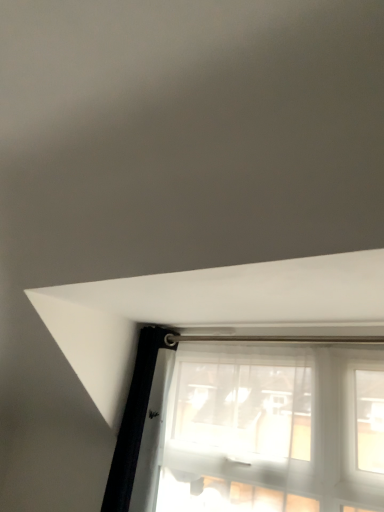
Question: Considering the relative sizes of metallic silver curtain rod at center and translucent fabric window at lower center in the image provided, is metallic silver curtain rod at center bigger than translucent fabric window at lower center?

Choices:
 (A) no
 (B) yes

Answer: (A)

Question: Considering the relative sizes of metallic silver curtain rod at center and translucent fabric window at lower center in the image provided, is metallic silver curtain rod at center taller than translucent fabric window at lower center?

Choices:
 (A) no
 (B) yes

Answer: (A)

Question: Does metallic silver curtain rod at center have a lesser width compared to translucent fabric window at lower center?

Choices:
 (A) yes
 (B) no

Answer: (B)

Question: From the image's perspective, is metallic silver curtain rod at center below translucent fabric window at lower center?

Choices:
 (A) no
 (B) yes

Answer: (A)

Question: Considering the relative sizes of metallic silver curtain rod at center and translucent fabric window at lower center in the image provided, is metallic silver curtain rod at center shorter than translucent fabric window at lower center?

Choices:
 (A) yes
 (B) no

Answer: (A)

Question: From a real-world perspective, is metallic silver curtain rod at center positioned over translucent fabric window at lower center based on gravity?

Choices:
 (A) yes
 (B) no

Answer: (A)

Question: From a real-world perspective, is translucent fabric window at lower center below metallic silver curtain rod at center?

Choices:
 (A) no
 (B) yes

Answer: (B)

Question: Is the position of translucent fabric window at lower center less distant than that of metallic silver curtain rod at center?

Choices:
 (A) no
 (B) yes

Answer: (B)

Question: Is translucent fabric window at lower center at the left side of metallic silver curtain rod at center?

Choices:
 (A) no
 (B) yes

Answer: (A)

Question: Can you confirm if translucent fabric window at lower center is wider than metallic silver curtain rod at center?

Choices:
 (A) no
 (B) yes

Answer: (A)

Question: Is the surface of translucent fabric window at lower center in direct contact with metallic silver curtain rod at center?

Choices:
 (A) yes
 (B) no

Answer: (B)

Question: Is metallic silver curtain rod at center at the back of translucent fabric window at lower center?

Choices:
 (A) no
 (B) yes

Answer: (A)

Question: In terms of width, does metallic silver curtain rod at center look wider or thinner when compared to translucent fabric window at lower center?

Choices:
 (A) wide
 (B) thin

Answer: (A)